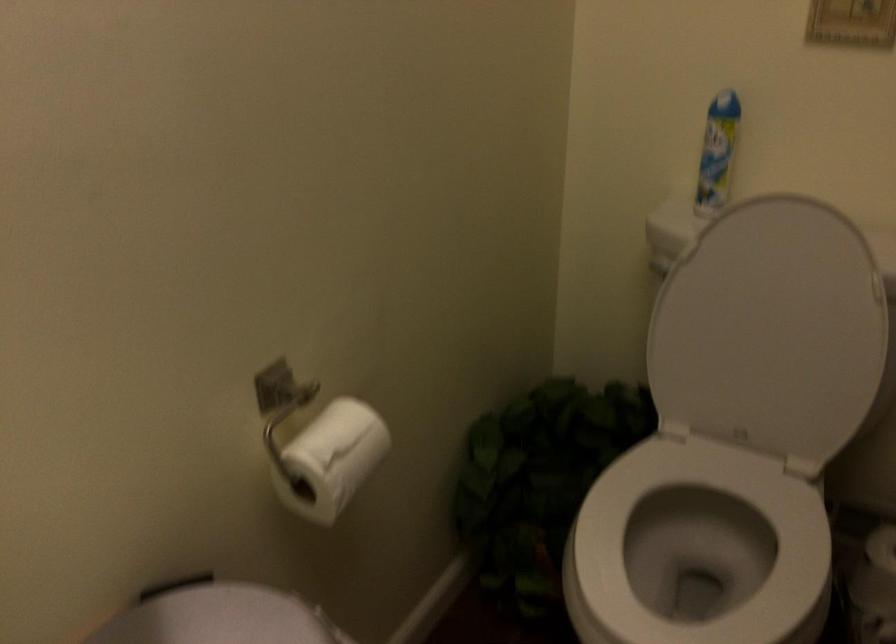
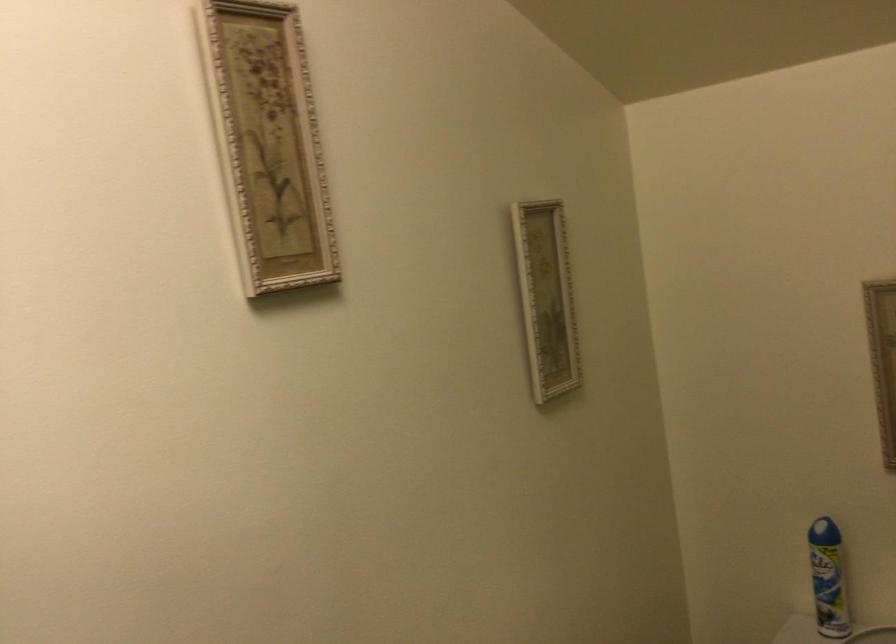
Question: The first image is from the beginning of the video and the second image is from the end. How did the camera likely rotate when shooting the video?

Choices:
 (A) Left
 (B) Right
 (C) Up
 (D) Down

Answer: (C)